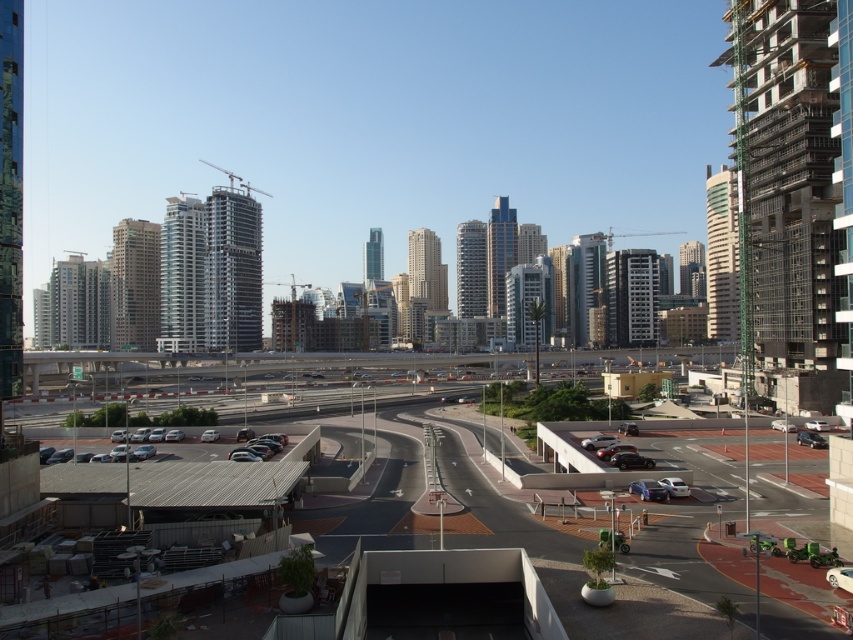
Question: Which object is farther from the camera taking this photo?

Choices:
 (A) asphalt road at center
 (B) satin silver sedan at center

Answer: (B)

Question: Does shiny metallic car at center appear on the left side of shiny silver sedan at center?

Choices:
 (A) yes
 (B) no

Answer: (A)

Question: Which of the following is the farthest from the observer?

Choices:
 (A) (663, 492)
 (B) (589, 438)

Answer: (B)

Question: Considering the relative positions of shiny blue sedan at center and white glossy sedan at lower right in the image provided, where is shiny blue sedan at center located with respect to white glossy sedan at lower right?

Choices:
 (A) below
 (B) above

Answer: (A)

Question: Is asphalt road at center thinner than white glossy sedan at lower right?

Choices:
 (A) no
 (B) yes

Answer: (A)

Question: Estimate the real-world distances between objects in this image. Which object is farther from the shiny silver sedan at center?

Choices:
 (A) asphalt road at center
 (B) satin silver sedan at center
 (C) shiny metallic car at center

Answer: (A)